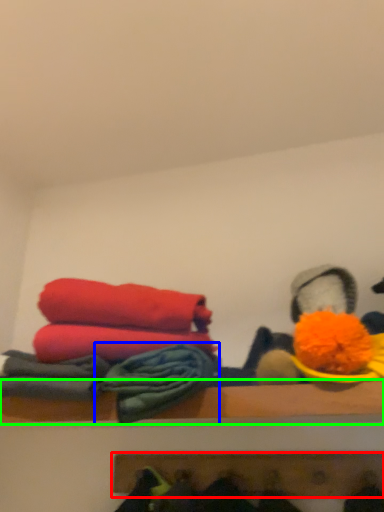
Question: Which object is positioned farthest from shelf (highlighted by a red box)? Select from material (highlighted by a blue box) and shelf (highlighted by a green box).

Choices:
 (A) material
 (B) shelf

Answer: (A)